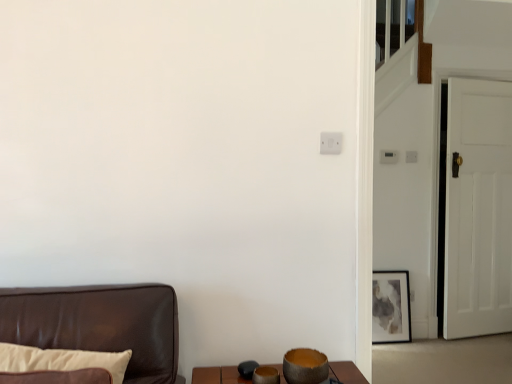
Question: From a real-world perspective, is white wooden door at right over matte gray painting at right?

Choices:
 (A) yes
 (B) no

Answer: (A)

Question: Is white wooden door at right taller than matte gray painting at right?

Choices:
 (A) yes
 (B) no

Answer: (A)

Question: Does white wooden door at right have a greater width compared to matte gray painting at right?

Choices:
 (A) no
 (B) yes

Answer: (B)

Question: Is there a large distance between white wooden door at right and matte gray painting at right?

Choices:
 (A) yes
 (B) no

Answer: (B)

Question: From the image's perspective, does white wooden door at right appear lower than matte gray painting at right?

Choices:
 (A) yes
 (B) no

Answer: (B)

Question: From a real-world perspective, is white wooden door at right physically located above or below white plastic light switch at upper right?

Choices:
 (A) above
 (B) below

Answer: (B)

Question: Looking at their shapes, would you say white wooden door at right is wider or thinner than white plastic light switch at upper right?

Choices:
 (A) thin
 (B) wide

Answer: (B)

Question: From the image's perspective, relative to white plastic light switch at upper right, is white wooden door at right above or below?

Choices:
 (A) above
 (B) below

Answer: (B)

Question: Visually, is white wooden door at right positioned to the left or to the right of white plastic light switch at upper right?

Choices:
 (A) right
 (B) left

Answer: (A)

Question: Considering their positions, is white plastic light switch at upper right located in front of or behind matte gray painting at right?

Choices:
 (A) front
 (B) behind

Answer: (B)

Question: Is point (382, 150) positioned closer to the camera than point (396, 339)?

Choices:
 (A) closer
 (B) farther

Answer: (A)

Question: Is white plastic light switch at upper right wider or thinner than matte gray painting at right?

Choices:
 (A) thin
 (B) wide

Answer: (A)

Question: Choose the correct answer: Is white plastic light switch at upper right inside matte gray painting at right or outside it?

Choices:
 (A) outside
 (B) inside

Answer: (A)

Question: In terms of size, does white wooden door at right appear bigger or smaller than matte gray painting at right?

Choices:
 (A) big
 (B) small

Answer: (A)

Question: From the image's perspective, is white wooden door at right located above or below matte gray painting at right?

Choices:
 (A) above
 (B) below

Answer: (A)